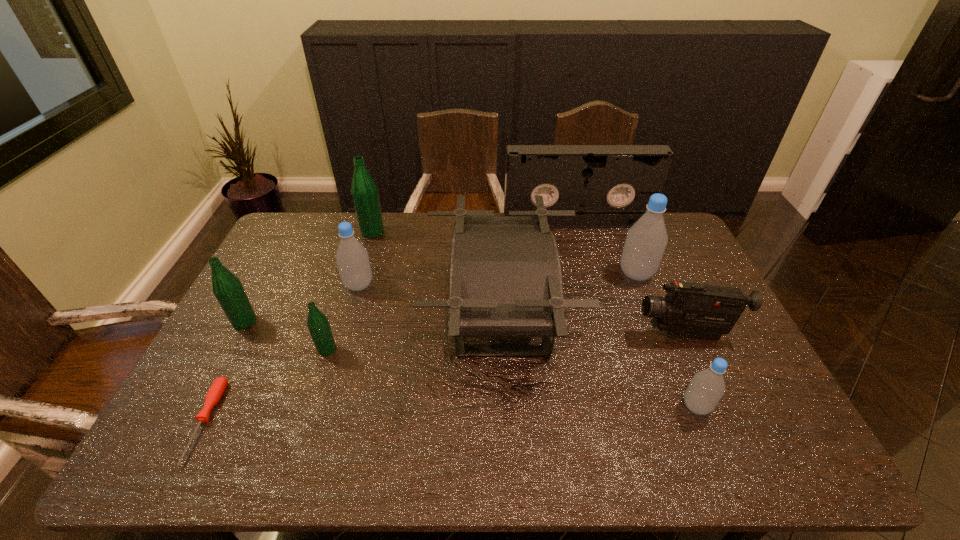
At what (x,y) coordinates should I click in order to perform the action: click on the eighth closest object to the shortest object. Please return your answer as a coordinate pair (x, y). Looking at the image, I should click on (707, 387).

Choose which object is the eighth nearest neighbor to the shortest object. Please provide its 2D coordinates. Your answer should be formatted as a tuple, i.e. [(x, y)], where the tuple contains the x and y coordinates of a point satisfying the conditions above.

[(707, 387)]

The image size is (960, 540). Find the location of `bottle that stands as the closest to the shortest object`. bottle that stands as the closest to the shortest object is located at coordinates coord(227,288).

Where is `the fourth closest bottle to the farthest green bottle`? the fourth closest bottle to the farthest green bottle is located at coordinates (646, 240).

In order to click on the second closest green bottle relative to the screwdriver in this screenshot , I will do `click(318, 324)`.

Locate an element on the screen. This screenshot has width=960, height=540. green bottle that is the second closest one to the black camcorder is located at coordinates (364, 191).

Locate which gray bottle is the closest to the biggest green bottle. Please provide its 2D coordinates. Your answer should be formatted as a tuple, i.e. [(x, y)], where the tuple contains the x and y coordinates of a point satisfying the conditions above.

[(352, 259)]

Identify which gray bottle is located as the third nearest to the drone. Please provide its 2D coordinates. Your answer should be formatted as a tuple, i.e. [(x, y)], where the tuple contains the x and y coordinates of a point satisfying the conditions above.

[(707, 387)]

Locate an element on the screen. This screenshot has width=960, height=540. free spot that satisfies the following two spatial constraints: 1. on the side of the videotape with visible spindles; 2. with a camera mounted on the underside of the drone is located at coordinates (602, 315).

I want to click on free location that satisfies the following two spatial constraints: 1. on the side of the biggest gray bottle with visible spindles; 2. on the left side of the gray videotape, so click(x=590, y=274).